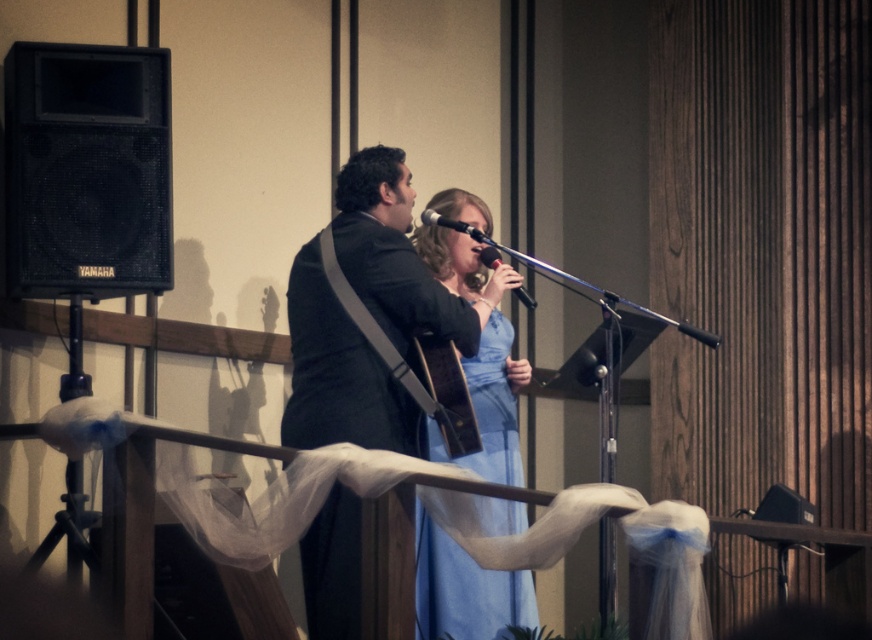
What do you see at coordinates (87, 170) in the screenshot? The width and height of the screenshot is (872, 640). I see `black mesh speaker at left` at bounding box center [87, 170].

Is point (83, 77) farther from viewer compared to point (487, 252)?

No, it is not.

Image resolution: width=872 pixels, height=640 pixels. I want to click on black mesh speaker at left, so click(x=87, y=170).

Between dark gray suit at center and black matte microphone at center, which one appears on the right side from the viewer's perspective?

From the viewer's perspective, black matte microphone at center appears more on the right side.

Who is more distant from viewer, (335, 323) or (475, 236)?

The point (475, 236) is behind.

You are a GUI agent. You are given a task and a screenshot of the screen. Output one action in this format:
    pyautogui.click(x=<x>, y=<y>)
    Task: Click on the dark gray suit at center
    The width and height of the screenshot is (872, 640).
    Given the screenshot: What is the action you would take?
    pyautogui.click(x=368, y=317)

Consider the image. Is black mesh speaker at left below light blue satin dress at center?

No, black mesh speaker at left is not below light blue satin dress at center.

Does black mesh speaker at left have a lesser width compared to light blue satin dress at center?

Incorrect, black mesh speaker at left's width is not less than light blue satin dress at center's.

I want to click on black mesh speaker at left, so click(87, 170).